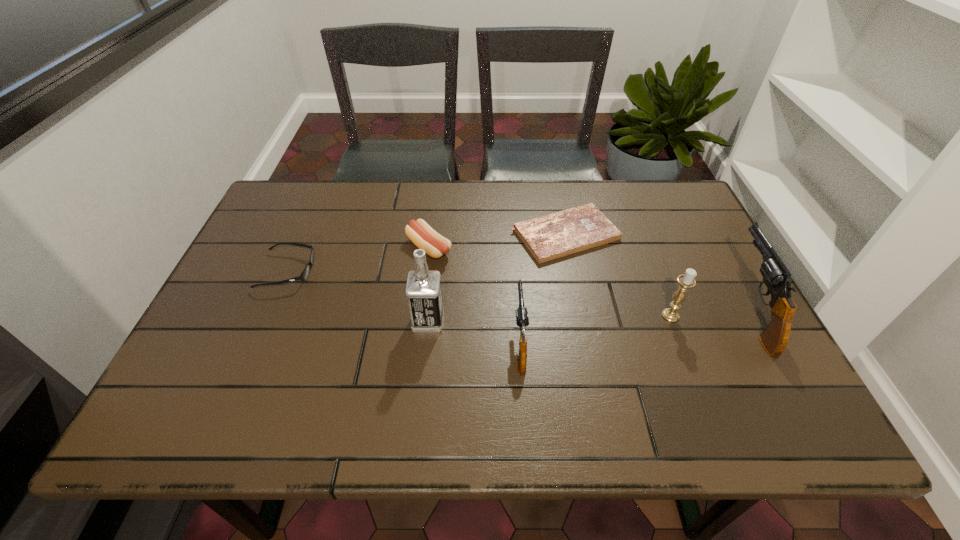
The image size is (960, 540). Identify the location of free location located on the front of the candle holder. (684, 350).

Identify the location of object at the far edge. (549, 237).

Locate an element on the screen. This screenshot has width=960, height=540. object located at the left edge is located at coordinates (304, 275).

At what (x,y) coordinates should I click in order to perform the action: click on object that is at the right edge. Please return your answer as a coordinate pair (x, y). The image size is (960, 540). Looking at the image, I should click on (776, 276).

This screenshot has height=540, width=960. What are the coordinates of `object that is at the near right corner` in the screenshot? It's located at (776, 276).

You are a GUI agent. You are given a task and a screenshot of the screen. Output one action in this format:
    pyautogui.click(x=<x>, y=<y>)
    Task: Click on the free region at the far edge
    
    Given the screenshot: What is the action you would take?
    pyautogui.click(x=341, y=212)

Where is `vacant region at the near edge`? This screenshot has height=540, width=960. vacant region at the near edge is located at coordinates (673, 387).

Image resolution: width=960 pixels, height=540 pixels. In order to click on vacant point at the left edge in this screenshot , I will do `click(292, 234)`.

Where is `vacant space at the far left corner of the desktop`? This screenshot has width=960, height=540. vacant space at the far left corner of the desktop is located at coordinates (278, 200).

At what (x,y) coordinates should I click in order to perform the action: click on free space at the far right corner of the desktop. Please return your answer as a coordinate pair (x, y). The image size is (960, 540). Looking at the image, I should click on (652, 220).